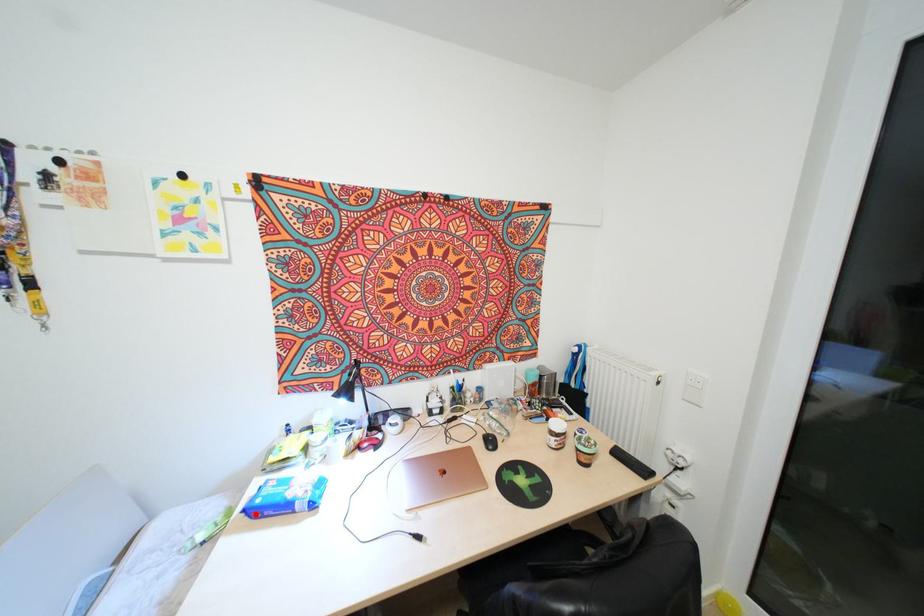
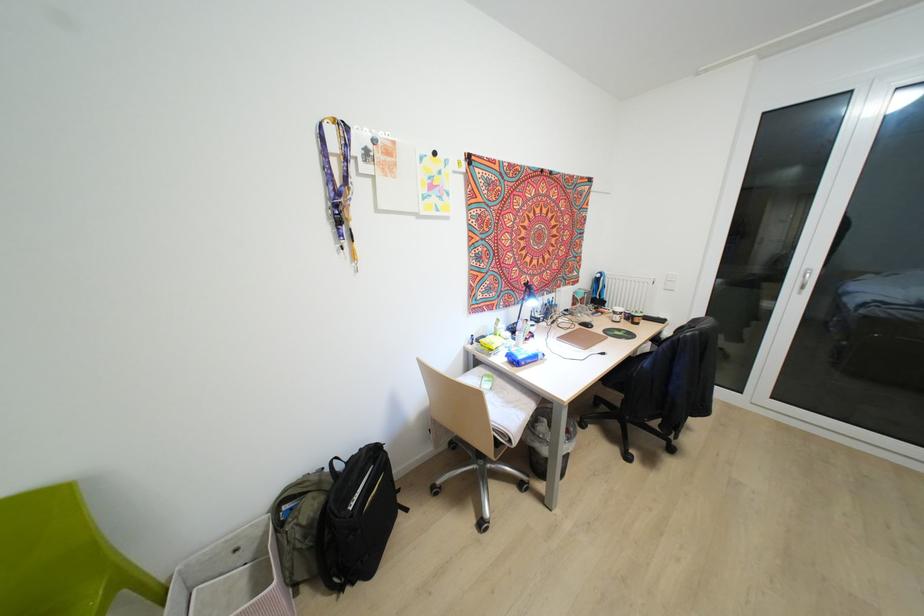
The point at the highlighted location is marked in the first image. Where is the corresponding point in the second image?

(523, 363)